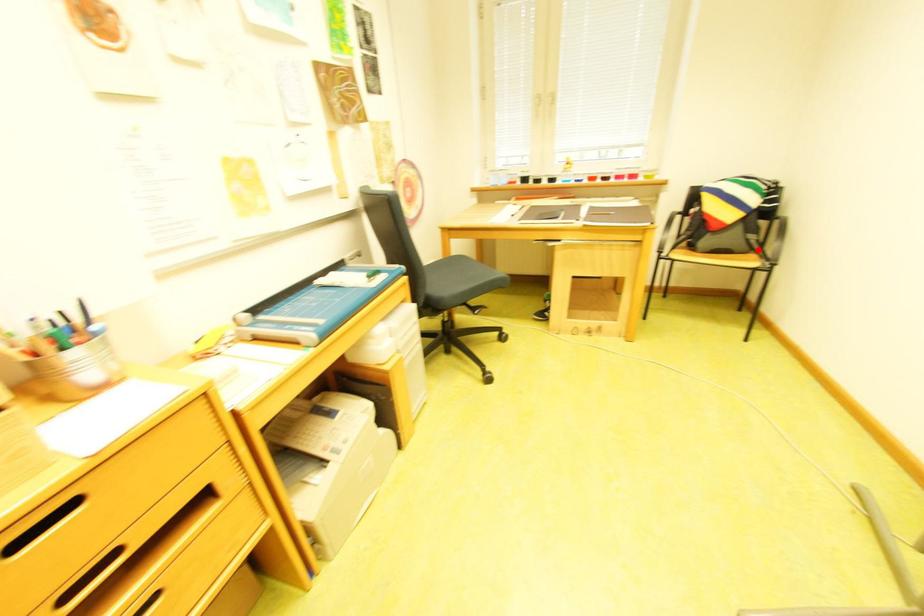
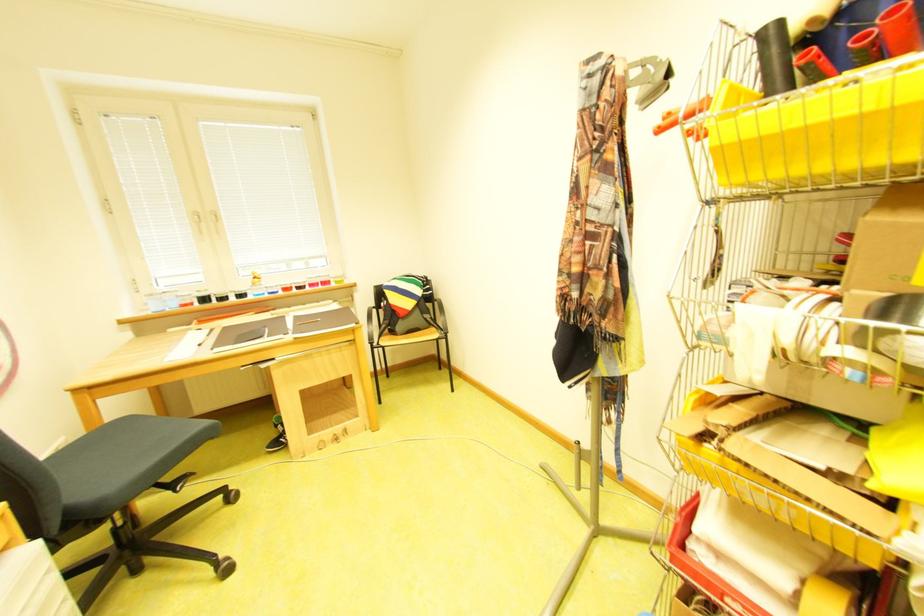
Locate, in the second image, the point that corresponds to the highlighted location in the first image.

(439, 326)